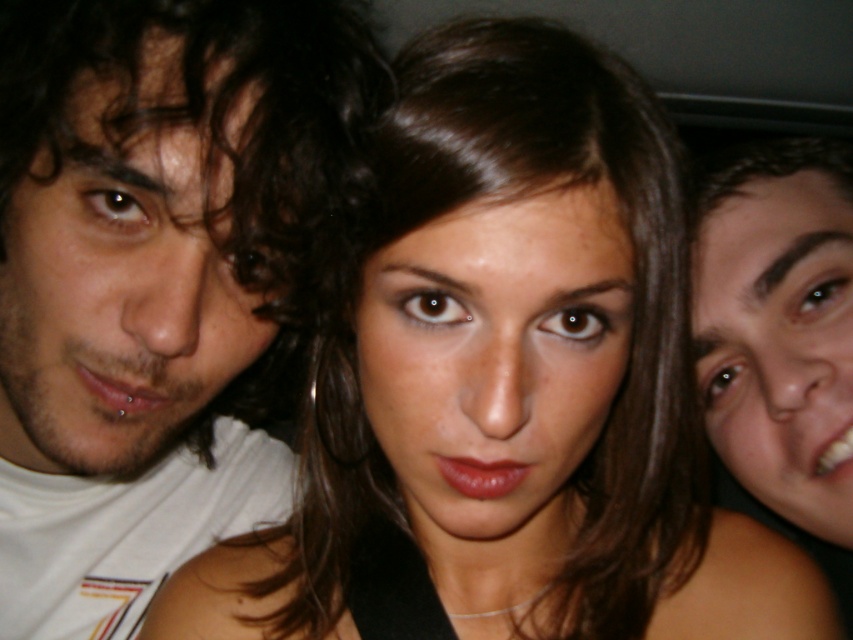
Is smooth skin face at center to the left of matte skin face at right from the viewer's perspective?

Correct, you'll find smooth skin face at center to the left of matte skin face at right.

Between smooth skin face at center and matte skin face at right, which one has more height?

Standing taller between the two is matte skin face at right.

Image resolution: width=853 pixels, height=640 pixels. I want to click on smooth skin face at center, so click(x=496, y=362).

Can you confirm if smooth skin face at left is positioned above smooth skin face at center?

Yes.

Does point (105, 424) come in front of point (498, 492)?

No, (105, 424) is further to viewer.

Identify the location of smooth skin face at left. The height and width of the screenshot is (640, 853). (119, 280).

Between point (225, 372) and point (729, 269), which one is positioned behind?

The point (729, 269) is more distant.

Which is behind, point (9, 230) or point (798, 272)?

The point (798, 272) is more distant.

Where is `smooth skin face at left`? This screenshot has width=853, height=640. smooth skin face at left is located at coordinates (119, 280).